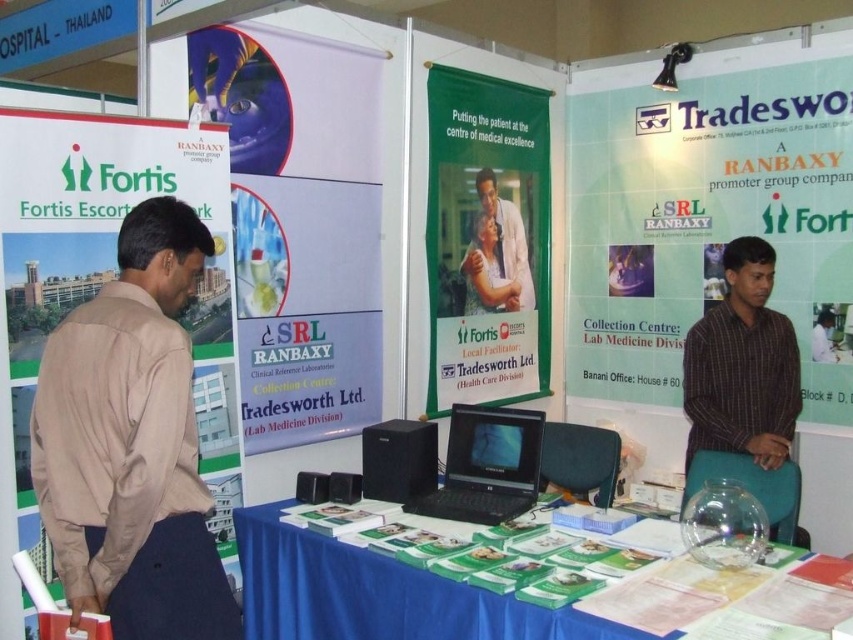
Which of these two, green matte banner at center or white lab coat at center, stands taller?

Standing taller between the two is green matte banner at center.

This screenshot has width=853, height=640. Describe the element at coordinates (486, 240) in the screenshot. I see `green matte banner at center` at that location.

Is point (514, 387) positioned behind point (521, 257)?

No, (514, 387) is closer to viewer.

This screenshot has width=853, height=640. What are the coordinates of `green matte banner at center` in the screenshot? It's located at (486, 240).

Is point (421, 612) positioned behind point (514, 429)?

No, it is in front of (514, 429).

Who is more distant from viewer, (x=335, y=637) or (x=505, y=467)?

Point (x=505, y=467)

The width and height of the screenshot is (853, 640). Identify the location of blue fabric table at center. (378, 595).

What are the coordinates of `green matte banner at center` in the screenshot? It's located at (486, 240).

Describe the element at coordinates (486, 240) in the screenshot. The width and height of the screenshot is (853, 640). I see `green matte banner at center` at that location.

Measure the distance between point (527, 145) and camera.

Point (527, 145) is 4.11 meters from camera.

Find the location of a particular element. green matte banner at center is located at coordinates (486, 240).